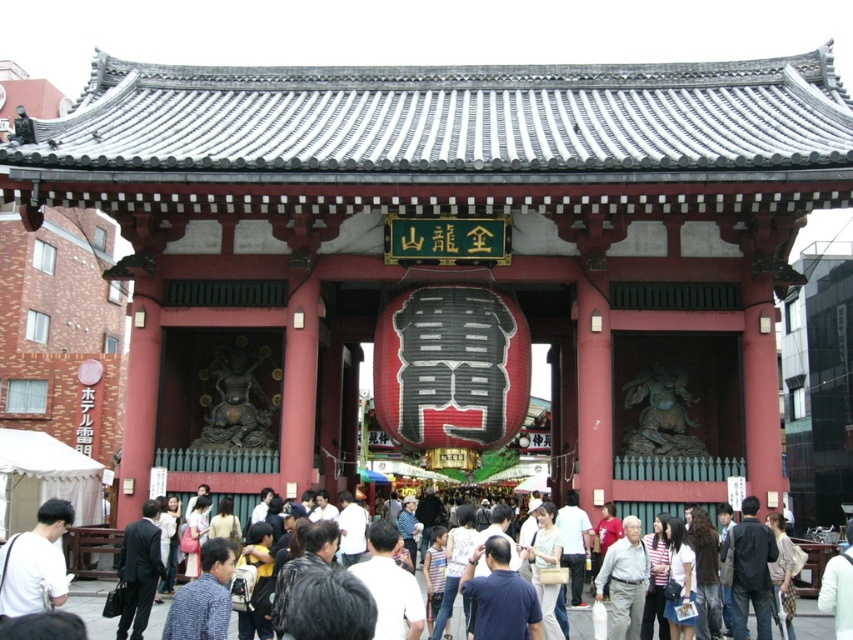
Question: Does dark brown hair at center appear over white cotton shirt at center?

Choices:
 (A) yes
 (B) no

Answer: (B)

Question: Can you confirm if white cotton shirt at center is positioned to the right of light brown textured bag at center?

Choices:
 (A) no
 (B) yes

Answer: (A)

Question: Which point is closer to the camera?

Choices:
 (A) (778, 628)
 (B) (556, 528)
 (C) (616, 605)
 (D) (706, 616)

Answer: (D)

Question: Which object appears closest to the camera in this image?

Choices:
 (A) white cotton shirt at center
 (B) dark brown hair at center
 (C) light brown textured bag at center
 (D) gray fabric shirt at center

Answer: (A)

Question: Is gray fabric shirt at center above white cotton shirt at center?

Choices:
 (A) yes
 (B) no

Answer: (A)

Question: Which point is closer to the camera?

Choices:
 (A) white cotton shirt at center
 (B) light brown textured bag at center
 (C) gray fabric shirt at center
 (D) dark brown hair at center

Answer: (A)